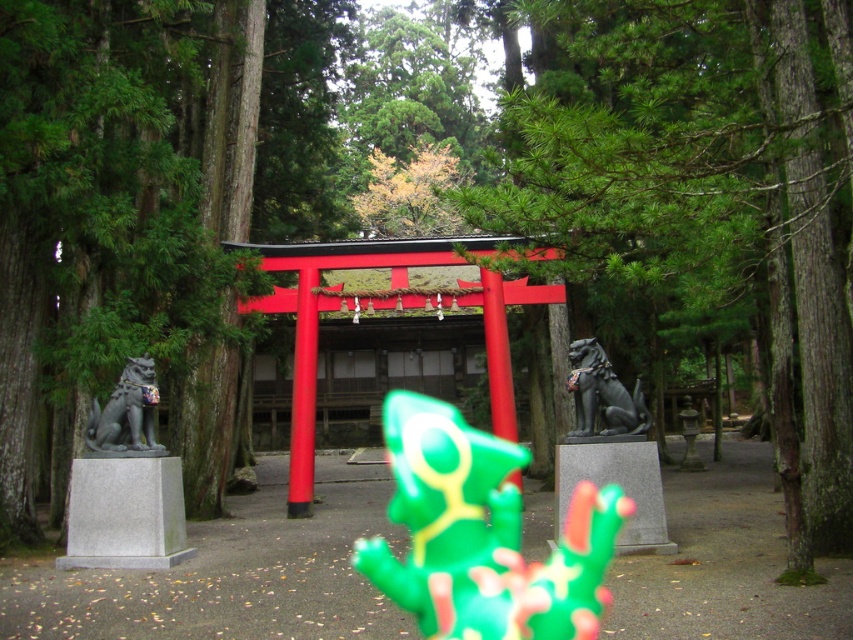
You are a photographer planning to capture a wide shot of the torii gate and its surroundings. You need to ensure that both the green leafy tree at center and the gray stone dog at left are fully visible in the frame. Based on their sizes, which object might require you to adjust your camera angle or position to accommodate its width?

The green leafy tree at center might be wider than the gray stone dog at left, so you may need to adjust your camera angle or position to ensure the tree fits within the frame.

You are a visitor at the shrine and want to place a small offering between the green leafy tree at center and the shiny black stone dog at center. The offering requires a space of 5 meters. Is there enough space between them?

The distance between the green leafy tree at center and the shiny black stone dog at center is 4.72 meters, which is less than the required 5 meters. Therefore, there is not enough space for the offering.

Based on the photo, you are a visitor approaching the torii gate and want to place a small offering on the shiny black stone dog at center. However, you notice a green leafy tree at center blocking your path. Can you walk around the tree to reach the dog?

The green leafy tree at center is positioned on the right side of shiny black stone dog at center, so you can walk around the tree to reach the dog by going to the left side of the tree.